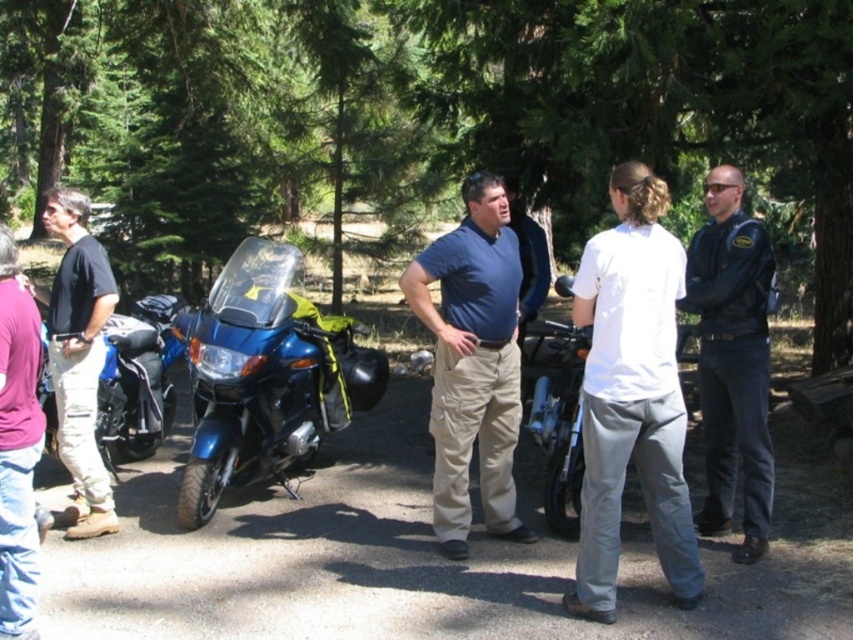
Question: Which is nearer to the green leafy tree at center?

Choices:
 (A) white cotton shirt at center
 (B) blue metallic motorcycle at center

Answer: (B)

Question: Is white cotton shirt at center in front of blue metallic motorcycle at center?

Choices:
 (A) yes
 (B) no

Answer: (A)

Question: Which point is farther from the camera taking this photo?

Choices:
 (A) (136, 374)
 (B) (717, 513)

Answer: (A)

Question: Does dark blue uniform at center have a lesser width compared to matte black shirt at left?

Choices:
 (A) yes
 (B) no

Answer: (B)

Question: Considering the real-world distances, which object is closest to the dark blue uniform at center?

Choices:
 (A) blue cotton shirt at center
 (B) matte black motorcycle at left
 (C) white cotton shirt at center

Answer: (C)

Question: Does green leafy tree at center appear on the right side of white cotton shirt at center?

Choices:
 (A) yes
 (B) no

Answer: (B)